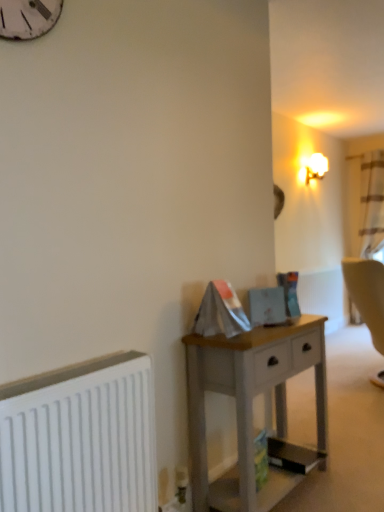
Question: From a real-world perspective, is white matte radiator at lower left positioned above or below white frosted glass lampshade at upper right?

Choices:
 (A) below
 (B) above

Answer: (A)

Question: Do you think white matte radiator at lower left is within white frosted glass lampshade at upper right, or outside of it?

Choices:
 (A) outside
 (B) inside

Answer: (A)

Question: Which object is the farthest from the white matte radiator at lower left?

Choices:
 (A) white frosted glass lampshade at upper right
 (B) white painted wood desk at center

Answer: (A)

Question: Which is farther from the white matte radiator at lower left?

Choices:
 (A) white painted wood desk at center
 (B) white frosted glass lampshade at upper right

Answer: (B)